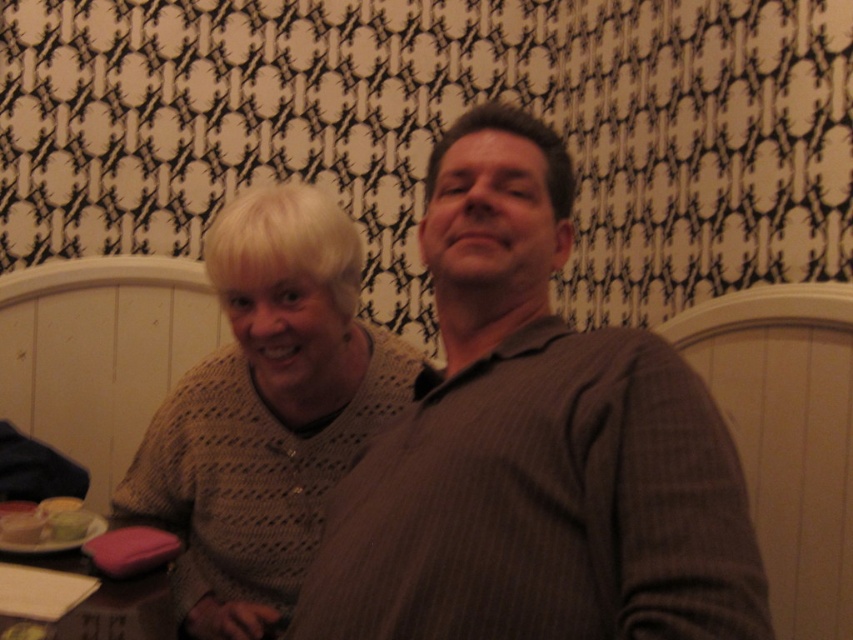
You are standing 5 feet away from the point at coordinates point (308, 392). If you move forward 1.5 feet, will you be closer to the point?

The distance of point (308, 392) from viewer is 3.53 feet. Since you are initially 5 feet away and move forward 1.5 feet, your new distance becomes 3.5 feet, which is closer than the original 3.53 feet. Yes, you will be closer to the point.

You are a fashion designer observing the scene. You need to decide whether the knitted beige sweater at center can be placed into the matte plastic container at lower left without removing the sweater from its current position. Can it be done?

The knitted beige sweater at center is positioned over matte plastic container at lower left, meaning the sweater is covering the container. Since the sweater is already over the container, it is likely that the sweater cannot be placed into the container without moving it from its current position.

You are organizing a clothing donation drive and need to determine if the gray striped shirt at center can fit into the matte plastic container at lower left. Based on their sizes, can the shirt be placed inside the container?

The gray striped shirt at center is wider than the matte plastic container at lower left, so the shirt cannot fit inside the container.